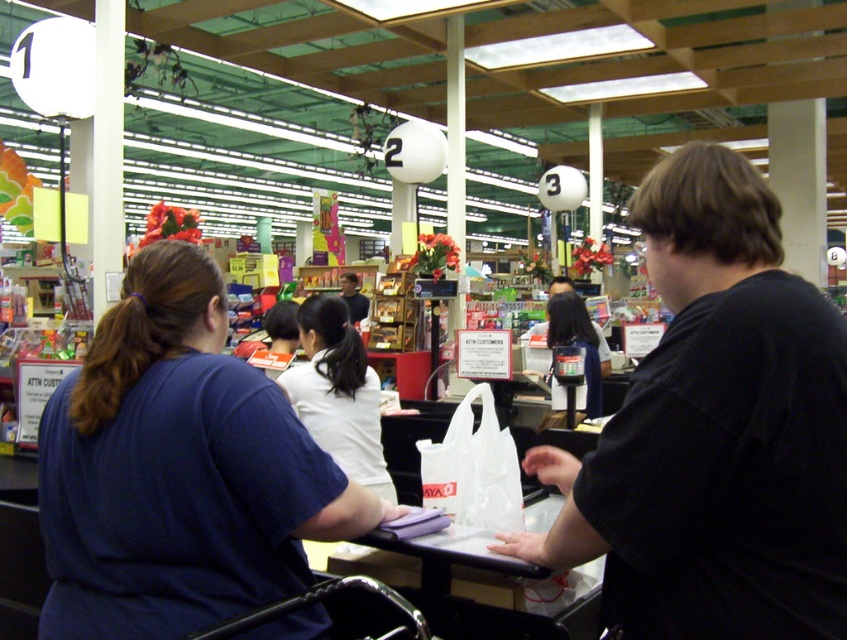
Is blue cotton shirt at center closer to camera compared to white matte shirt at center?

Yes, it is.

Is point (180, 305) positioned before point (306, 376)?

Yes.

Does point (108, 608) come farther from viewer compared to point (339, 442)?

No, it is in front of (339, 442).

Locate an element on the screen. Image resolution: width=847 pixels, height=640 pixels. blue cotton shirt at center is located at coordinates (178, 468).

The image size is (847, 640). Describe the element at coordinates (713, 429) in the screenshot. I see `black matte shirt at right` at that location.

Who is more distant from viewer, (673, 259) or (340, 376)?

Positioned behind is point (340, 376).

Identify the location of black matte shirt at right. This screenshot has height=640, width=847. (713, 429).

Can you confirm if black matte shirt at right is positioned above matte black purse at center?

Indeed, black matte shirt at right is positioned over matte black purse at center.

This screenshot has height=640, width=847. I want to click on black matte shirt at right, so click(713, 429).